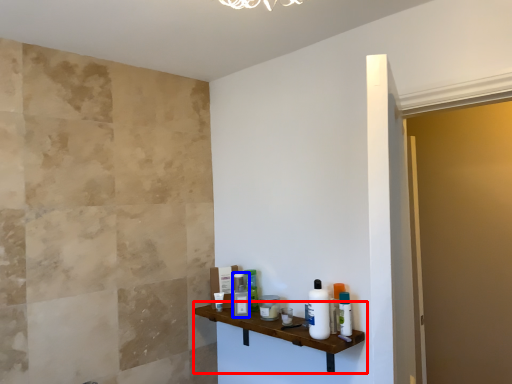
Question: Which of the following is the closest to the observer, shelf (highlighted by a red box) or toiletry (highlighted by a blue box)?

Choices:
 (A) shelf
 (B) toiletry

Answer: (A)